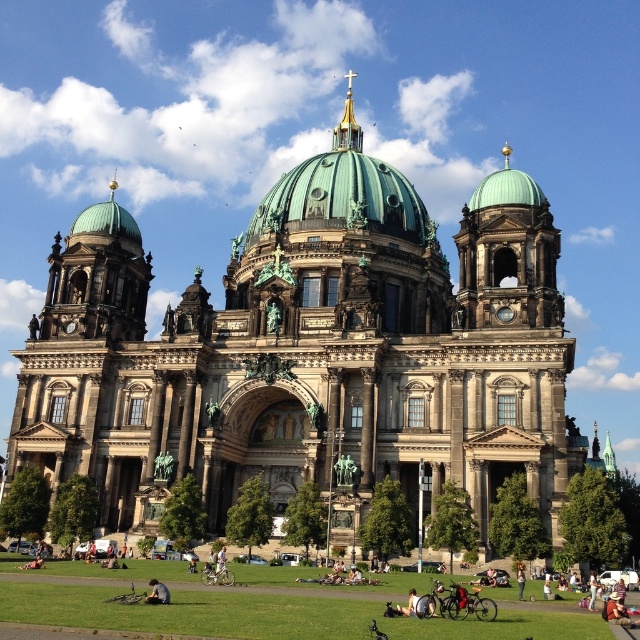
Looking at this image, is dark gray stone church at center below dark gray fabric jacket at lower center?

Incorrect, dark gray stone church at center is not positioned below dark gray fabric jacket at lower center.

Does dark gray stone church at center have a smaller size compared to dark gray fabric jacket at lower center?

No, dark gray stone church at center is not smaller than dark gray fabric jacket at lower center.

This screenshot has width=640, height=640. I want to click on dark gray stone church at center, so click(308, 353).

You are a GUI agent. You are given a task and a screenshot of the screen. Output one action in this format:
    pyautogui.click(x=<x>, y=<y>)
    Task: Click on the dark gray stone church at center
    
    Given the screenshot: What is the action you would take?
    pyautogui.click(x=308, y=353)